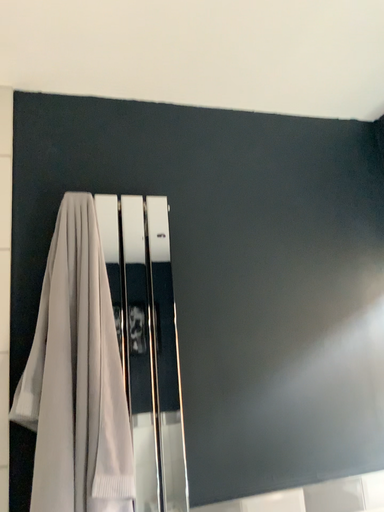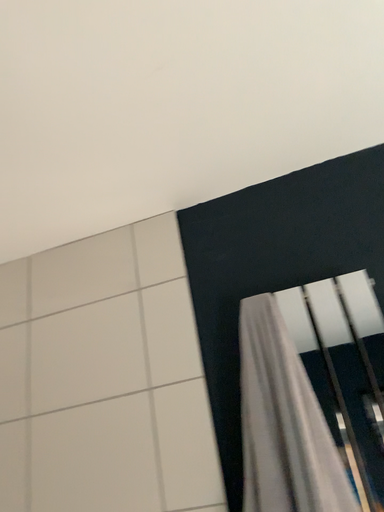
Question: How did the camera likely rotate when shooting the video?

Choices:
 (A) rotated left
 (B) rotated right

Answer: (A)